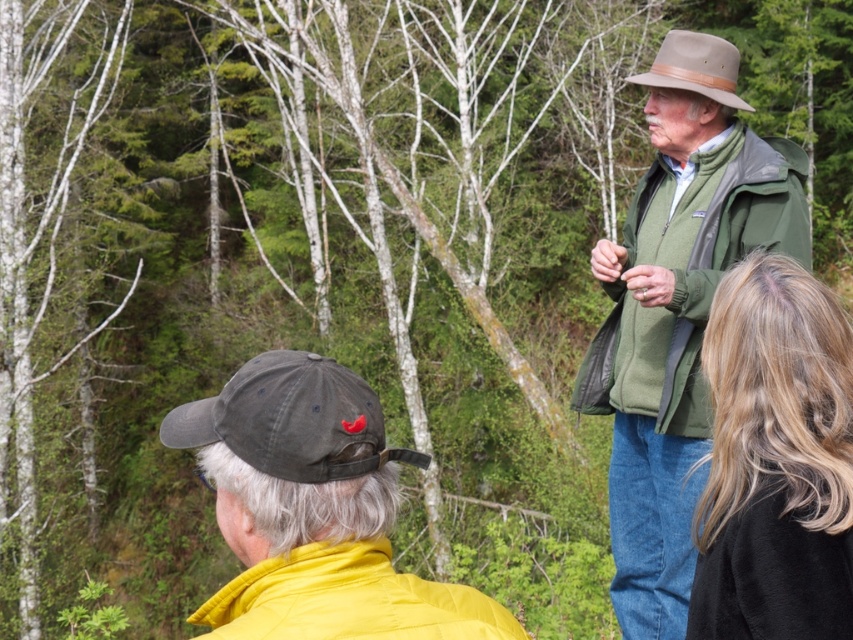
Question: Which of these objects is positioned farthest from the yellow quilted jacket at lower left?

Choices:
 (A) yellow fabric jacket at lower left
 (B) green fleece jacket at upper right
 (C) blonde hair at center

Answer: (B)

Question: Which point is farther to the camera?

Choices:
 (A) yellow fabric jacket at lower left
 (B) green fleece jacket at upper right
 (C) blonde hair at center
 (D) yellow quilted jacket at lower left

Answer: (B)

Question: Is yellow fabric jacket at lower left bigger than blonde hair at center?

Choices:
 (A) no
 (B) yes

Answer: (A)

Question: Is yellow fabric jacket at lower left smaller than yellow quilted jacket at lower left?

Choices:
 (A) yes
 (B) no

Answer: (B)

Question: Is blonde hair at center to the right of yellow quilted jacket at lower left from the viewer's perspective?

Choices:
 (A) yes
 (B) no

Answer: (A)

Question: Estimate the real-world distances between objects in this image. Which object is farther from the yellow quilted jacket at lower left?

Choices:
 (A) green fleece jacket at upper right
 (B) yellow fabric jacket at lower left
 (C) blonde hair at center

Answer: (A)